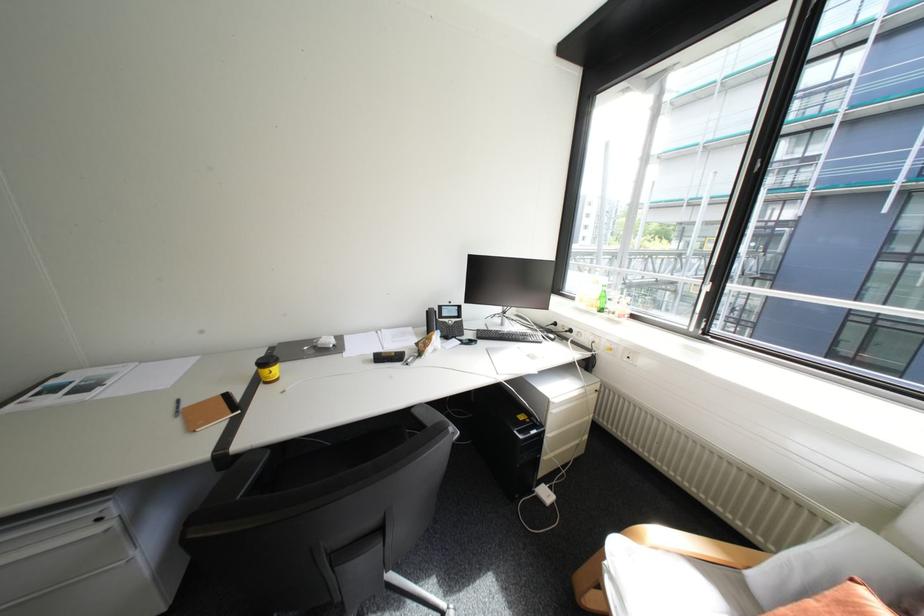
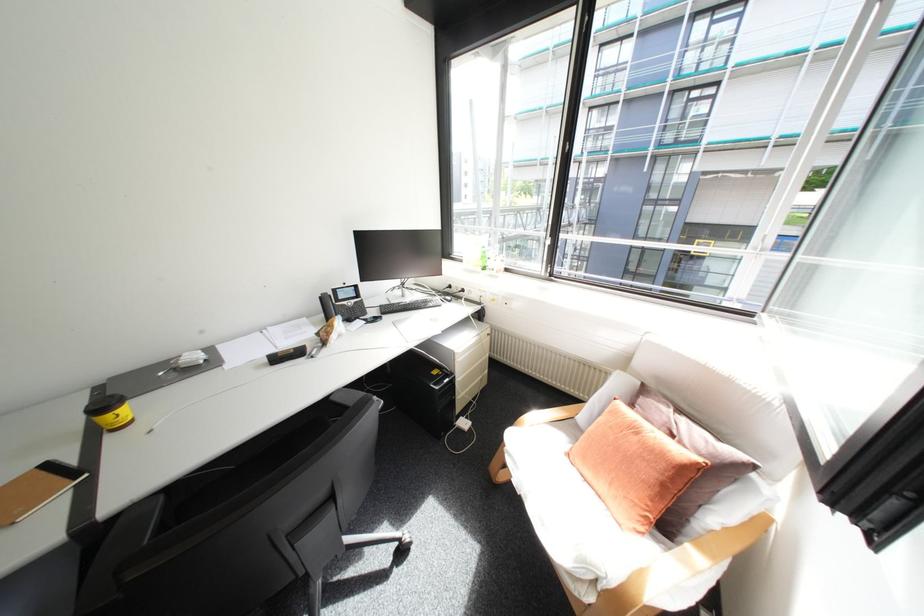
Locate, in the second image, the point that corresponds to [602,305] in the first image.

(487, 265)